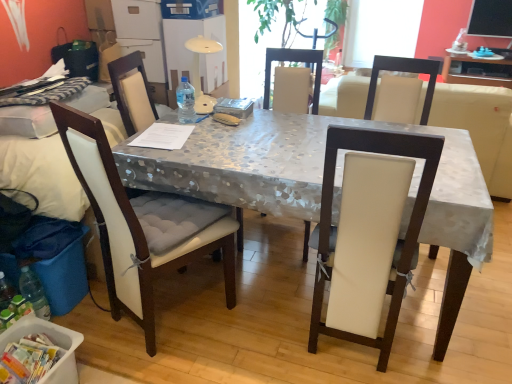
Question: Would you say matte gray table at upper right is inside or outside metallic silver table at center?

Choices:
 (A) inside
 (B) outside

Answer: (B)

Question: From a real-world perspective, is matte gray table at upper right physically located above or below metallic silver table at center?

Choices:
 (A) above
 (B) below

Answer: (B)

Question: Estimate the real-world distances between objects in this image. Which object is closer to the white leather chair at center, the third chair viewed from the left?

Choices:
 (A) white plastic container at lower left
 (B) matte gray table at upper right
 (C) white leather couch at center
 (D) white fabric chair at left, the 3th chair in the right-to-left sequence
 (E) white fabric chair at left, which ranks as the second chair in left-to-right order

Answer: (D)

Question: Considering the real-world distances, which object is farthest from the white leather chair at center, the third chair viewed from the left?

Choices:
 (A) matte gray table at upper right
 (B) white plastic container at lower left
 (C) white leather couch at center
 (D) white fabric chair at left, the 3th chair in the right-to-left sequence
 (E) metallic silver table at center

Answer: (C)